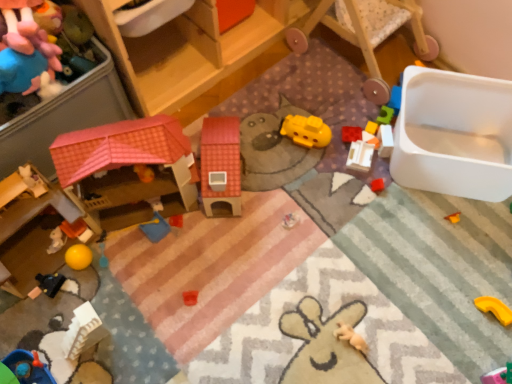
This screenshot has width=512, height=384. In order to click on vacant area that is in front of black matte toy car at lower left, arranged as the 2th toy when viewed from the left in this screenshot , I will do `click(50, 332)`.